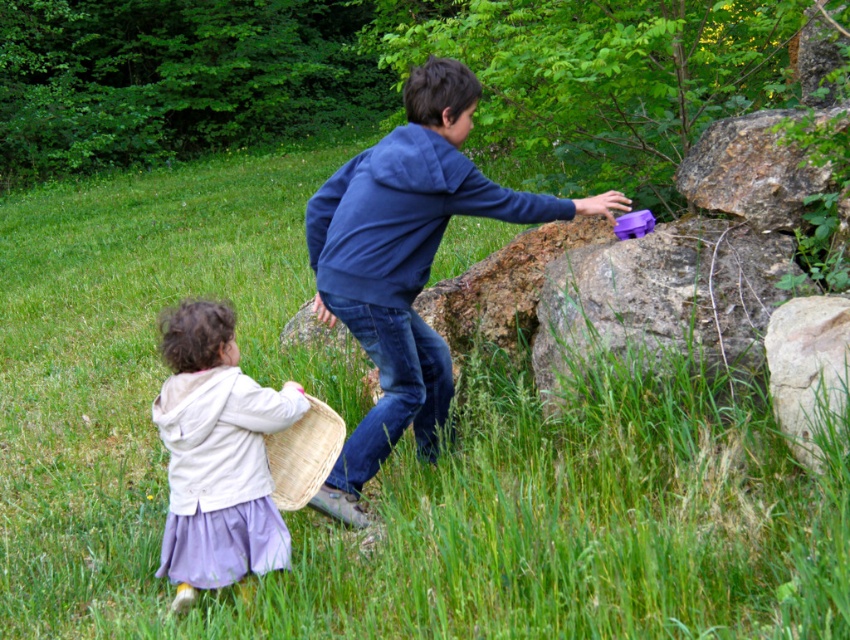
In the scene shown: You are a hiker trying to cross a rocky path. You see the rough stone boulder at center right and the rusty stone boulder at upper right. Which boulder should you step on to ensure a wider base for stability?

You should step on the rough stone boulder at center right because it might be wider than the rusty stone boulder at upper right, providing a more stable base.

You are a photographer trying to capture the smooth gray rock at lower right. The camera you are using has a zoom lens that can focus on objects within a radius of 0.1 units from a specific point. If you aim the camera at point [808,368], will the smooth gray rock at lower right be in focus?

The smooth gray rock at lower right is located at point [808,368], so yes, aiming the camera at that point will place the smooth gray rock at lower right within the focus radius of 0.1 units.